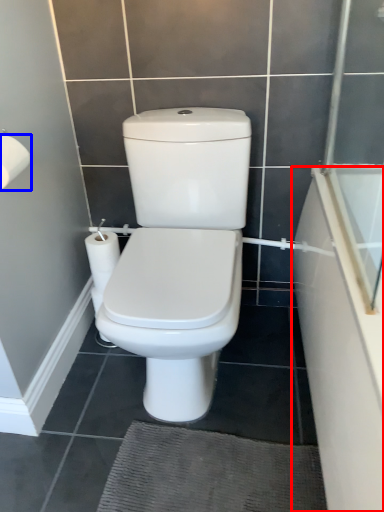
Question: Which object is closer to the camera taking this photo, bath (highlighted by a red box) or toilet paper (highlighted by a blue box)?

Choices:
 (A) bath
 (B) toilet paper

Answer: (A)